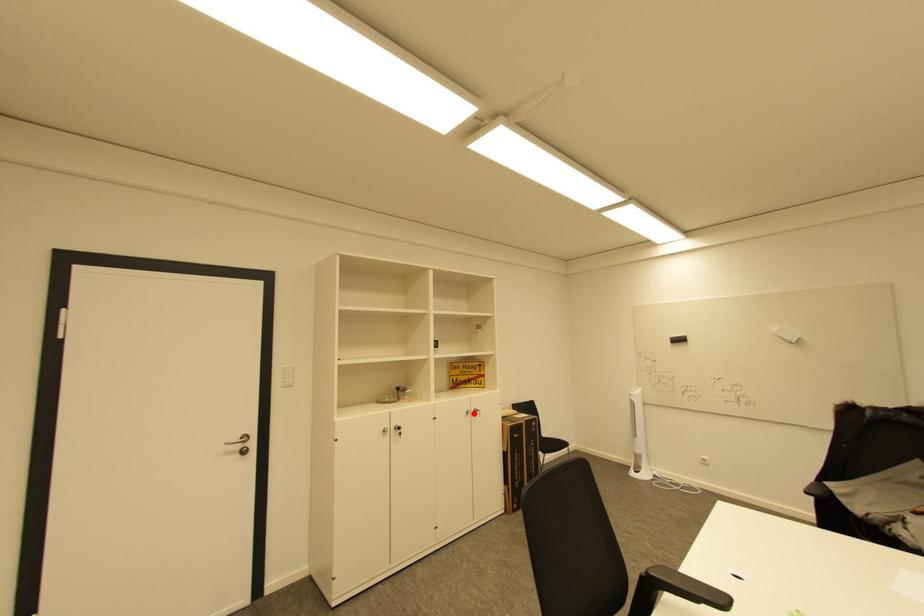
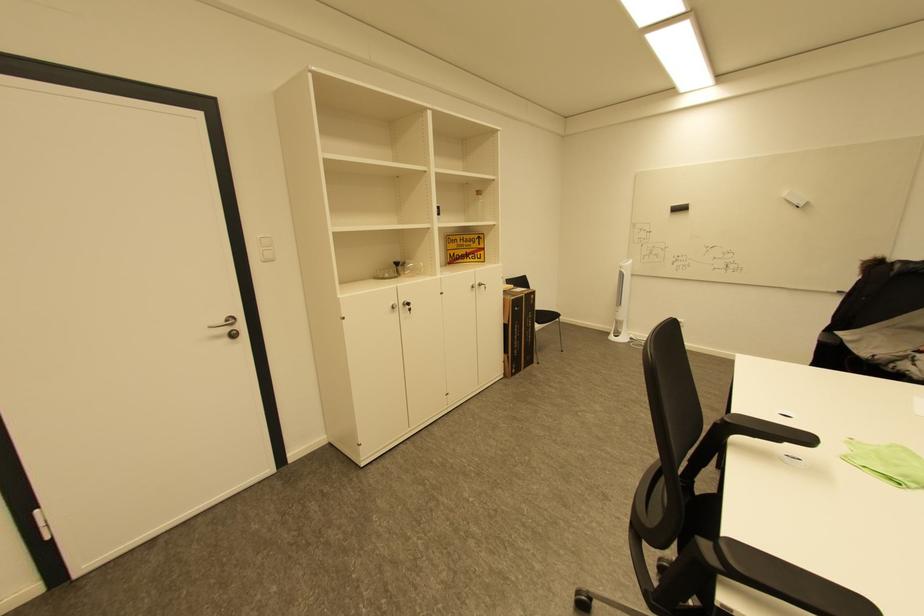
Question: I am providing you with two images of the same scene from different viewpoints. Image1 has a red point marked. In image2, the corresponding 3D location appears at what relative position? Reply with the corresponding letter.

Choices:
 (A) Closer
 (B) Farther

Answer: (A)